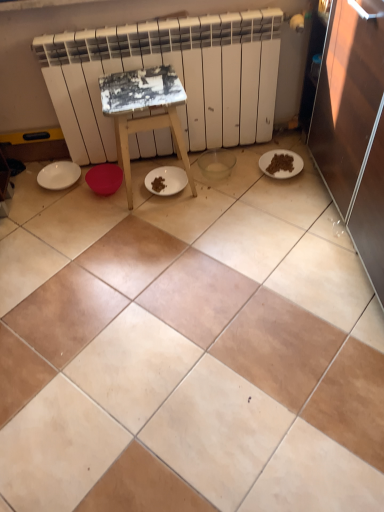
Locate an element on the screen. This screenshot has height=512, width=384. vacant area that is in front of white painted wood stool at center is located at coordinates (159, 226).